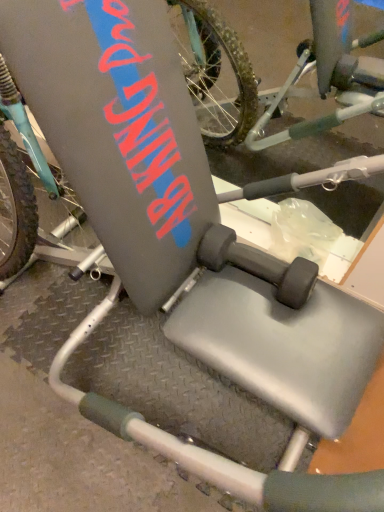
Question: Should I look upward or downward to see matte gray bicycle at center?

Choices:
 (A) up
 (B) down

Answer: (A)